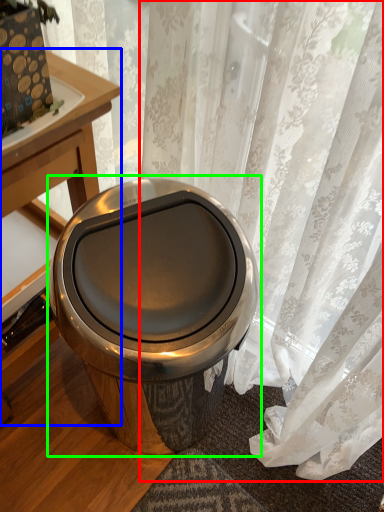
Question: Considering the real-world distances, which object is closest to curtain (highlighted by a red box)? table (highlighted by a blue box) or toilet (highlighted by a green box).

Choices:
 (A) table
 (B) toilet

Answer: (B)